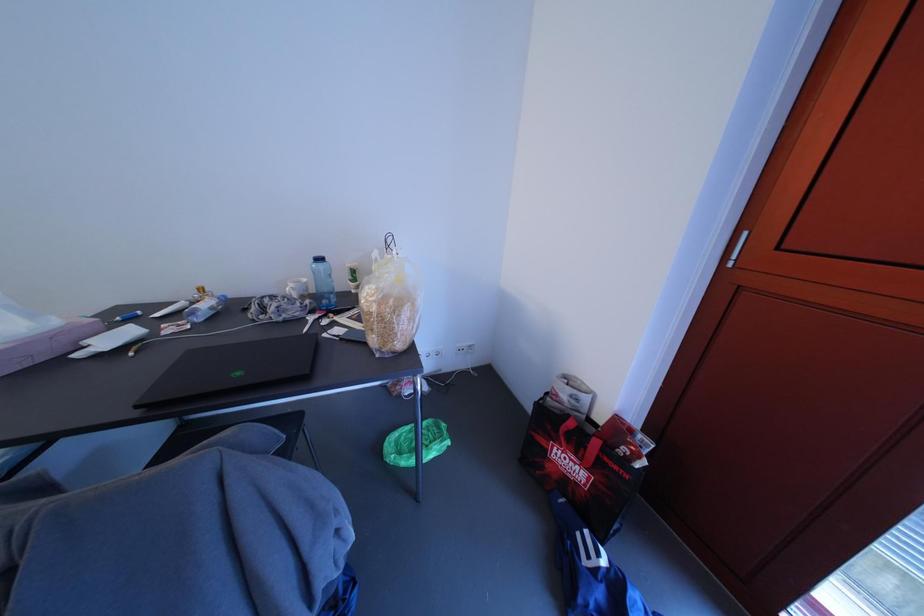
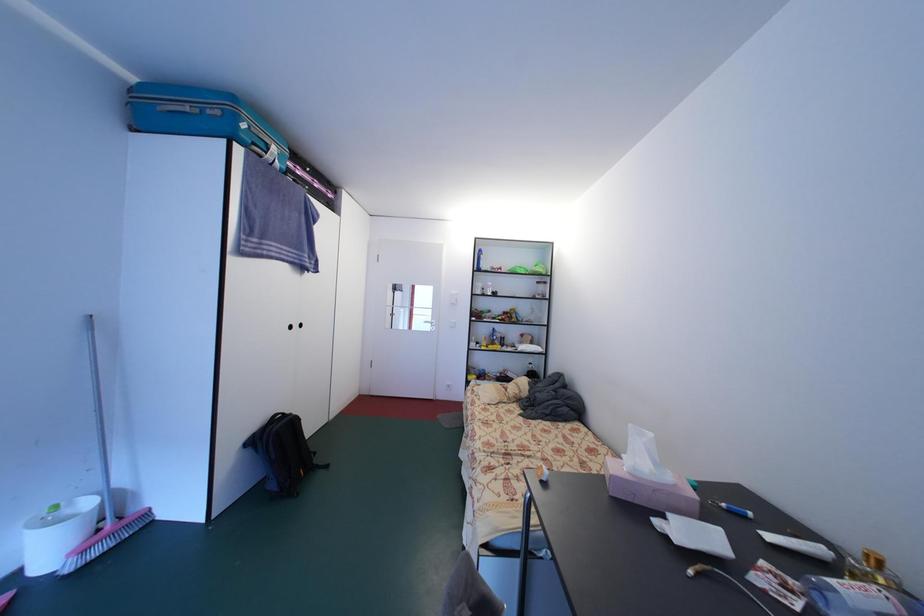
Question: How did the camera likely rotate?

Choices:
 (A) Left
 (B) Right
 (C) Up
 (D) Down

Answer: (A)